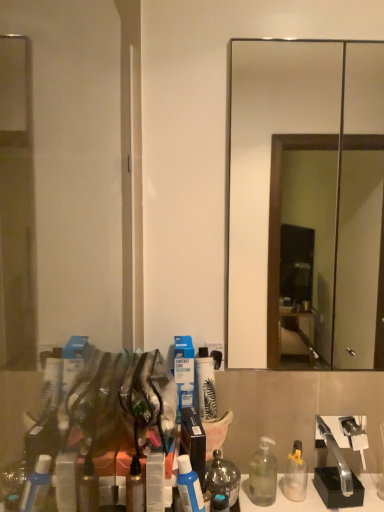
Question: Which direction should I rotate to look at translucent amber bottle at center, which ranks as the 1th bottle in front-to-back order?

Choices:
 (A) right
 (B) left

Answer: (B)

Question: Which direction should I rotate to look at white matte spray can at center, which is counted as the second toiletry, starting from the left, — up or down?

Choices:
 (A) down
 (B) up

Answer: (A)

Question: Is clear plastic bottle at lower right, which appears as the 3th bottle when viewed from the left, aimed at smooth glass mirror at center?

Choices:
 (A) no
 (B) yes

Answer: (A)

Question: From a real-world perspective, is clear plastic bottle at lower right, which appears as the 3th bottle when viewed from the left, located beneath smooth glass mirror at center?

Choices:
 (A) yes
 (B) no

Answer: (A)

Question: Is clear plastic bottle at lower right, which is the 1th bottle from back to front, completely or partially outside of smooth glass mirror at center?

Choices:
 (A) no
 (B) yes

Answer: (B)

Question: Does clear plastic bottle at lower right, which appears as the first bottle when viewed from the right, lie behind smooth glass mirror at center?

Choices:
 (A) no
 (B) yes

Answer: (B)

Question: Is clear plastic bottle at lower right, which is the third bottle from front to back, turned away from smooth glass mirror at center?

Choices:
 (A) no
 (B) yes

Answer: (A)

Question: From a real-world perspective, is clear plastic bottle at lower right, which appears as the 3th bottle when viewed from the left, on smooth glass mirror at center?

Choices:
 (A) yes
 (B) no

Answer: (B)

Question: Is the depth of blue cardboard box at center, the first toiletry in the left-to-right sequence, less than that of smooth glass mirror at center?

Choices:
 (A) no
 (B) yes

Answer: (A)

Question: Is blue cardboard box at center, the first toiletry in the left-to-right sequence, in contact with smooth glass mirror at center?

Choices:
 (A) no
 (B) yes

Answer: (A)

Question: Is blue cardboard box at center, the first toiletry in the left-to-right sequence, turned away from smooth glass mirror at center?

Choices:
 (A) yes
 (B) no

Answer: (B)

Question: Are blue cardboard box at center, the first toiletry in the left-to-right sequence, and smooth glass mirror at center located far from each other?

Choices:
 (A) no
 (B) yes

Answer: (B)

Question: Can you confirm if blue cardboard box at center, the first toiletry in the left-to-right sequence, is positioned to the right of smooth glass mirror at center?

Choices:
 (A) yes
 (B) no

Answer: (B)

Question: Is blue cardboard box at center, the second toiletry positioned from the right, completely or partially outside of smooth glass mirror at center?

Choices:
 (A) yes
 (B) no

Answer: (A)

Question: Is smooth glass mirror at center oriented towards satin silver mouthwash at lower center?

Choices:
 (A) yes
 (B) no

Answer: (B)